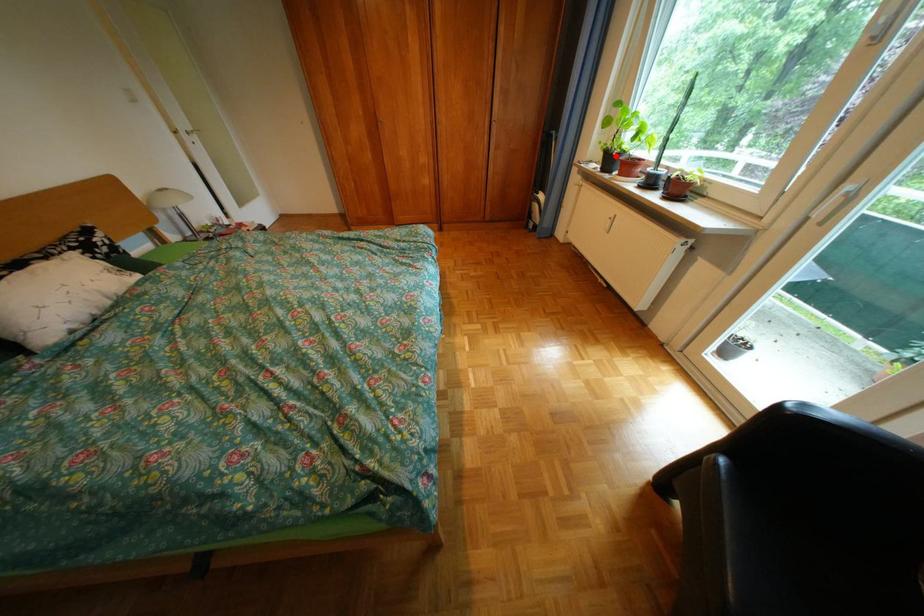
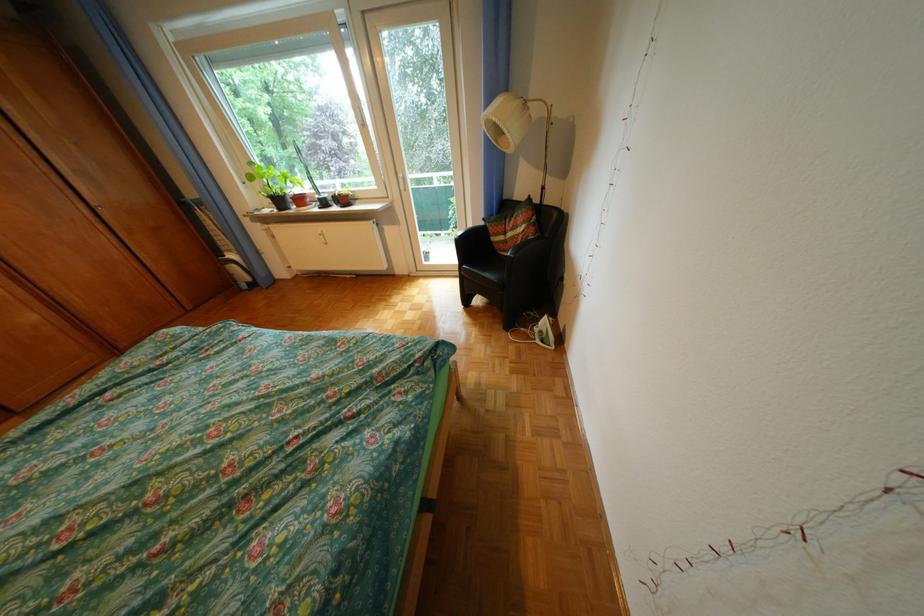
Question: I am providing you with two images of the same scene from different viewpoints. Image1 has a red point marked. In image2, the corresponding 3D location appears at what relative position? Reply with the corresponding letter.

Choices:
 (A) Closer
 (B) Farther

Answer: (B)